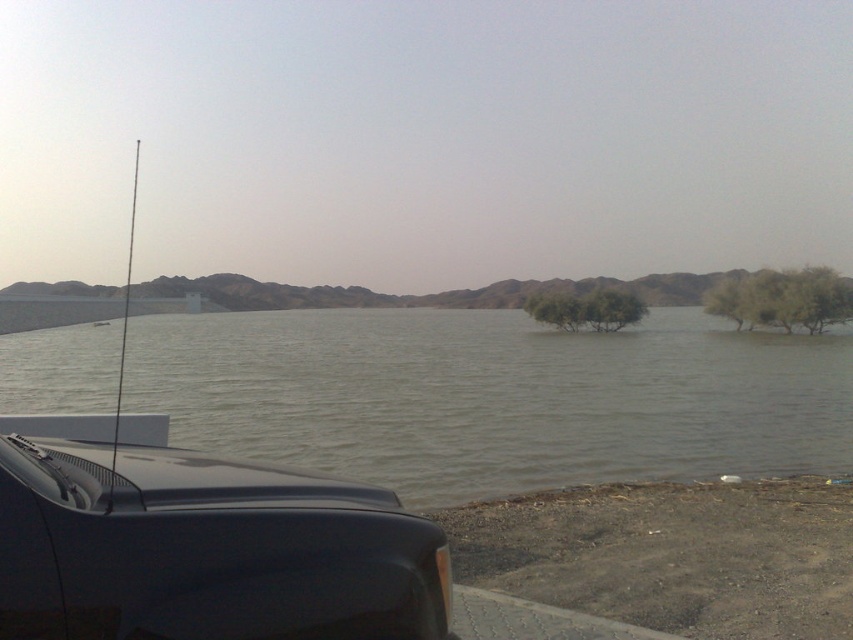
You are a hiker trying to cross the area. You see the gray matte water at center and the glossy black car at lower left. Which object is higher in elevation?

The gray matte water at center is located above the glossy black car at lower left, meaning it has a higher elevation.

You are standing at the edge of the water near the vehicle and want to take a photo. There are two points in the image labeled as point 1 and point 2. Point 1 is at coordinates point (265, 420) and point 2 is at point (405, 582). Which point is closer to your camera when taking the photo?

Point (265, 420) is further to the camera than point (405, 582), so point 2 is closer to the camera.

You are a hiker who wants to cross the gray matte water at center to reach the green leafy tree at right. Based on the scene description, is there a clear path between them?

The gray matte water at center is to the left of green leafy tree at right, but the scene mentions submerged trees indicating high water levels. This suggests the path may be obstructed by submerged vegetation, making it unclear if there is a safe path.